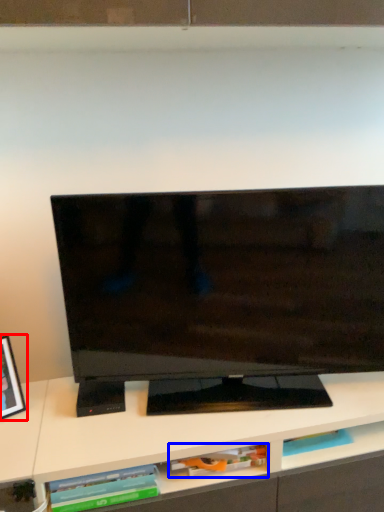
Question: Which object is closer to the camera taking this photo, picture frame (highlighted by a red box) or book (highlighted by a blue box)?

Choices:
 (A) picture frame
 (B) book

Answer: (A)